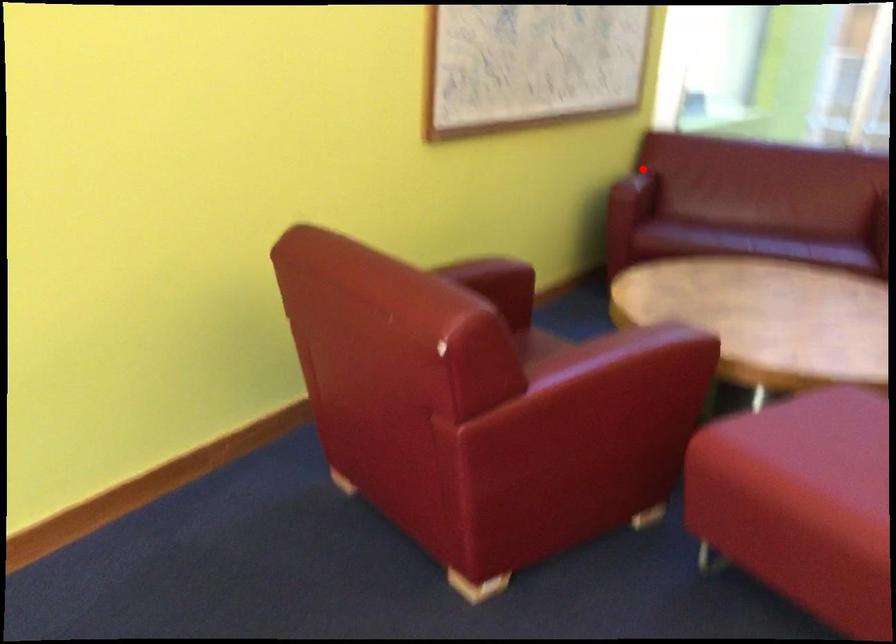
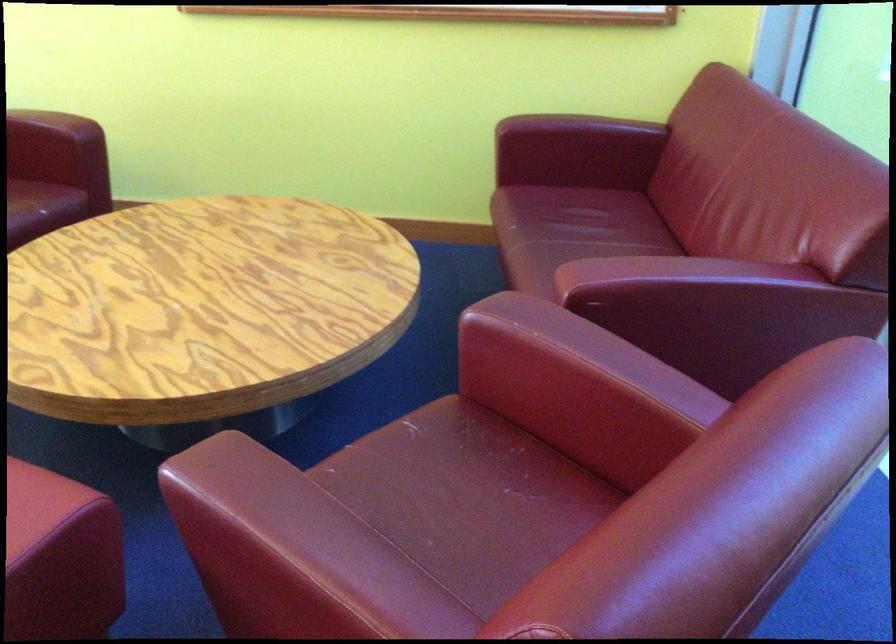
Question: I am providing you with two images of the same scene from different viewpoints. A red point is shown in image1. For the corresponding object point in image2, is it positioned nearer or farther from the camera?

Choices:
 (A) Nearer
 (B) Farther

Answer: (A)